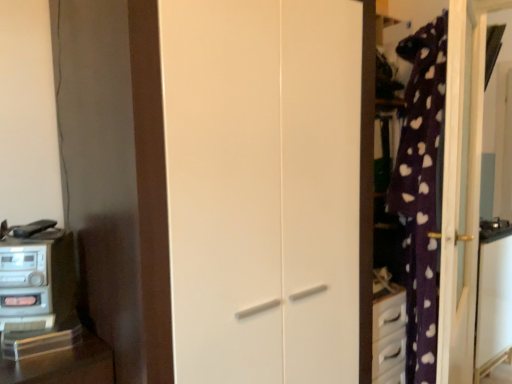
Measure the distance between point [16,268] and camera.

The distance of point [16,268] from camera is 3.58 feet.

Image resolution: width=512 pixels, height=384 pixels. What do you see at coordinates (36, 278) in the screenshot?
I see `metallic silver stereo at left` at bounding box center [36, 278].

Find the location of a particular element. The height and width of the screenshot is (384, 512). metallic silver stereo at left is located at coordinates (36, 278).

Measure the distance between white matte door at center and camera.

A distance of 36.49 inches exists between white matte door at center and camera.

Locate an element on the screen. The height and width of the screenshot is (384, 512). white matte door at center is located at coordinates (263, 188).

Image resolution: width=512 pixels, height=384 pixels. Describe the element at coordinates (263, 188) in the screenshot. I see `white matte door at center` at that location.

This screenshot has width=512, height=384. What are the coordinates of `metallic silver stereo at left` in the screenshot? It's located at (36, 278).

Considering the relative positions of white matte door at center and metallic silver stereo at left in the image provided, is white matte door at center to the left or to the right of metallic silver stereo at left?

In the image, white matte door at center appears on the right side of metallic silver stereo at left.

Is white matte door at center positioned in front of metallic silver stereo at left?

Yes.

Is point (289, 115) positioned behind point (66, 316)?

That is True.

From the image's perspective, between white matte door at center and metallic silver stereo at left, which one is located above?

white matte door at center is shown above in the image.

From a real-world perspective, does white matte door at center stand above metallic silver stereo at left?

Yes.

Which of these two, white matte door at center or metallic silver stereo at left, is wider?

white matte door at center is wider.

Is white matte door at center taller than metallic silver stereo at left?

Yes.

In terms of size, does white matte door at center appear bigger or smaller than metallic silver stereo at left?

Considering their sizes, white matte door at center takes up more space than metallic silver stereo at left.

Do you think white matte door at center is within metallic silver stereo at left, or outside of it?

white matte door at center cannot be found inside metallic silver stereo at left.

Is white matte door at center placed right next to metallic silver stereo at left?

No, white matte door at center is not in contact with metallic silver stereo at left.

Is white matte door at center turned away from metallic silver stereo at left?

No, white matte door at center is not facing the opposite direction of metallic silver stereo at left.

What's the angular difference between white matte door at center and metallic silver stereo at left's facing directions?

They differ by 32.1 degrees in their facing directions.

I want to click on door above the metallic silver stereo at left (from a real-world perspective), so click(263, 188).

Which is more to the left, metallic silver stereo at left or white matte door at center?

From the viewer's perspective, metallic silver stereo at left appears more on the left side.

Between metallic silver stereo at left and white matte door at center, which one is positioned in front?

white matte door at center.

Which point is more forward, (64, 267) or (226, 66)?

The point (226, 66) is more forward.

From the image's perspective, which one is positioned lower, metallic silver stereo at left or white matte door at center?

metallic silver stereo at left.

From a real-world perspective, between metallic silver stereo at left and white matte door at center, who is vertically higher?

white matte door at center.

Which of these two, metallic silver stereo at left or white matte door at center, is wider?

With larger width is white matte door at center.

Does metallic silver stereo at left have a lesser height compared to white matte door at center?

Correct, metallic silver stereo at left is not as tall as white matte door at center.

Considering the sizes of objects metallic silver stereo at left and white matte door at center in the image provided, who is bigger, metallic silver stereo at left or white matte door at center?

white matte door at center.

Is metallic silver stereo at left positioned beyond the bounds of white matte door at center?

Absolutely, metallic silver stereo at left is external to white matte door at center.

Looking at this image, are metallic silver stereo at left and white matte door at center far apart?

Actually, metallic silver stereo at left and white matte door at center are a little close together.

Is metallic silver stereo at left oriented away from white matte door at center?

Yes.

The width and height of the screenshot is (512, 384). What are the coordinates of `door lying on the right of metallic silver stereo at left` in the screenshot? It's located at (263, 188).

This screenshot has height=384, width=512. What are the coordinates of `appliance below the white matte door at center (from a real-world perspective)` in the screenshot? It's located at (36, 278).

Find the location of a particular element. This screenshot has width=512, height=384. appliance behind the white matte door at center is located at coordinates (36, 278).